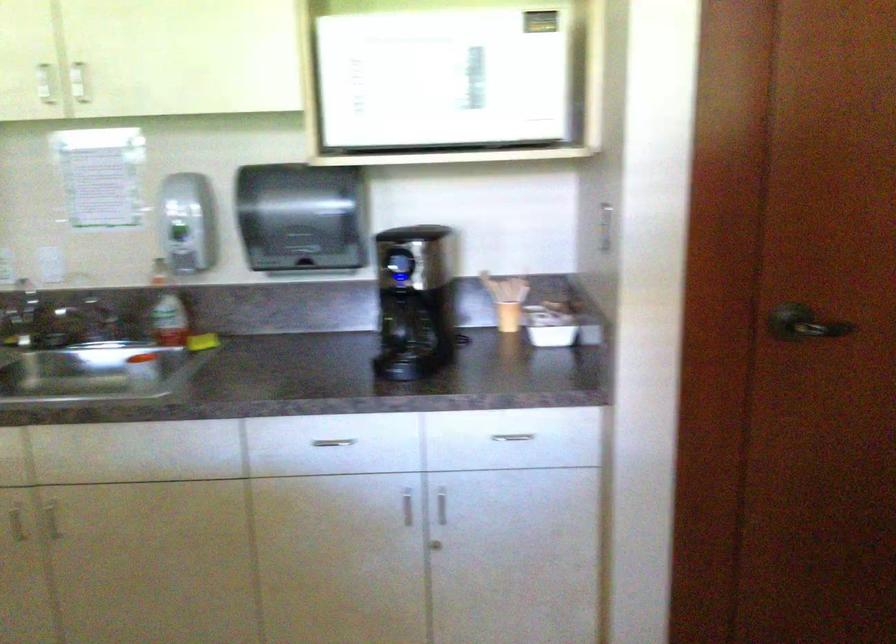
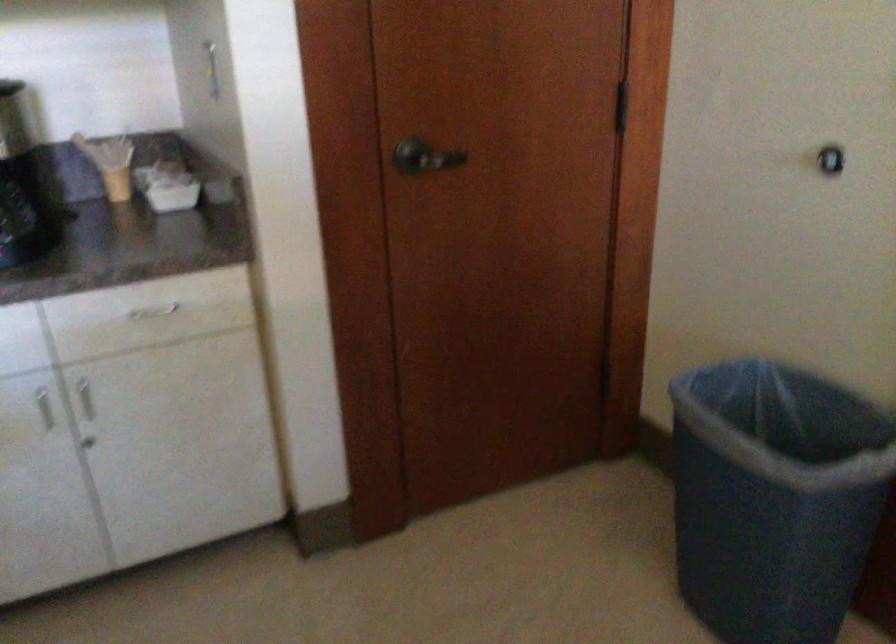
Question: The camera is either moving clockwise (left) or counter-clockwise (right) around the object. The first image is from the beginning of the video and the second image is from the end. Is the camera moving left or right when shooting the video?

Choices:
 (A) Left
 (B) Right

Answer: (A)